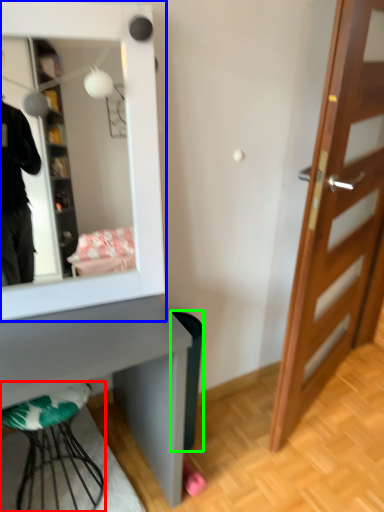
Question: Estimate the real-world distances between objects in this image. Which object is closer to furniture (highlighted by a red box), mirror (highlighted by a blue box) or trash bin/can (highlighted by a green box)?

Choices:
 (A) mirror
 (B) trash bin/can

Answer: (B)